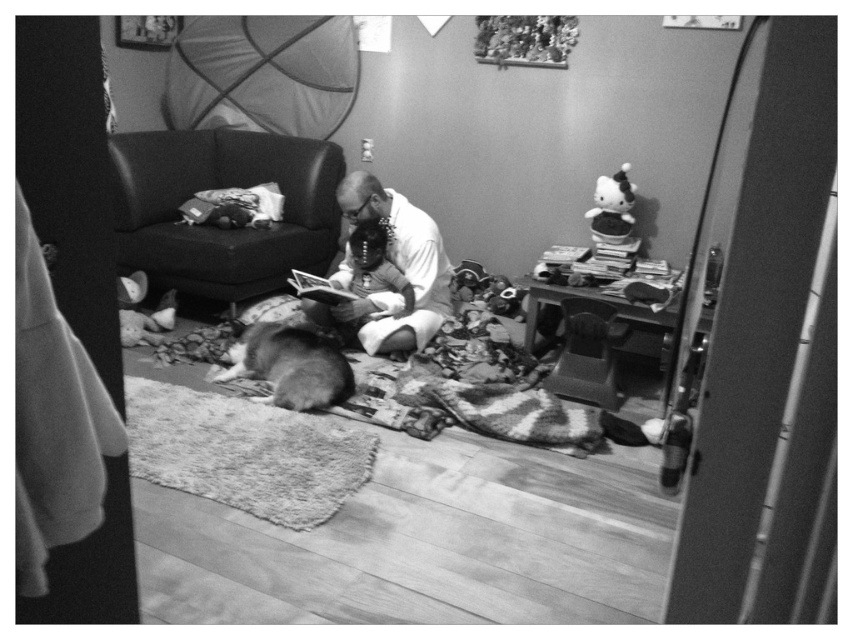
You are a photographer trying to capture a candid shot of the white matte shirt at center without the fluffy white dog at center appearing in the frame. Is this possible given their positions?

The fluffy white dog at center is behind the white matte shirt at center, so it is possible to capture a shot of the white matte shirt at center without the dog appearing in the frame by focusing on the front area where the shirt is positioned.